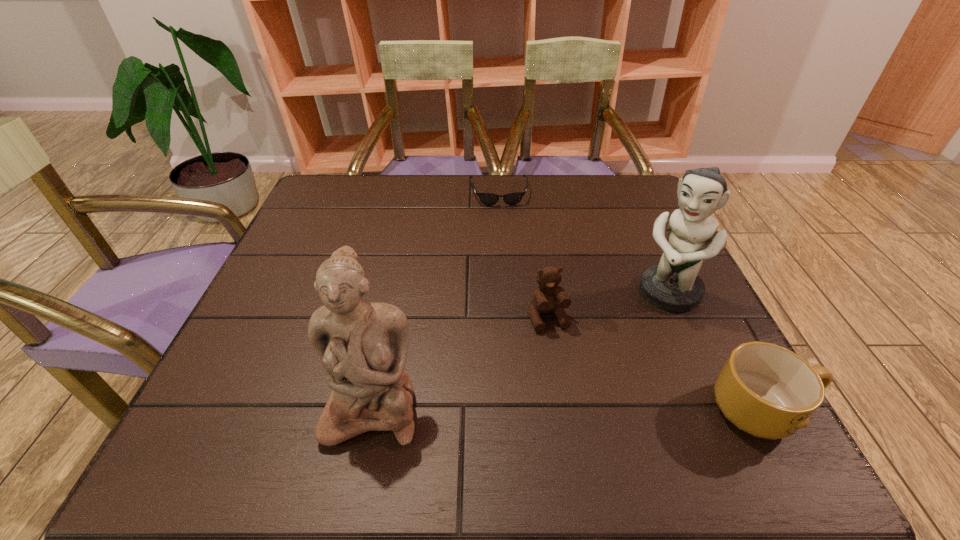
In order to click on the left figurine in this screenshot , I will do `click(363, 346)`.

Where is `the nearer figurine`? The width and height of the screenshot is (960, 540). the nearer figurine is located at coordinates (363, 346).

Identify the location of the fourth tallest object. Image resolution: width=960 pixels, height=540 pixels. (768, 391).

Image resolution: width=960 pixels, height=540 pixels. What are the coordinates of `the shortest object` in the screenshot? It's located at (489, 199).

Find the location of `sunglasses`. sunglasses is located at coordinates (489, 199).

Identify the location of teddy bear. (549, 297).

Find the location of a particular element. Image resolution: width=960 pixels, height=540 pixels. the farther figurine is located at coordinates (673, 285).

You are a GUI agent. You are given a task and a screenshot of the screen. Output one action in this format:
    pyautogui.click(x=<x>, y=<y>)
    Task: Click on the vacant space situated on the front-facing side of the farthest object
    
    Given the screenshot: What is the action you would take?
    pyautogui.click(x=503, y=226)

Identify the location of free space located 0.280m on the front-facing side of the farthest object. The height and width of the screenshot is (540, 960). (509, 275).

I want to click on vacant space located on the front-facing side of the farthest object, so click(x=509, y=272).